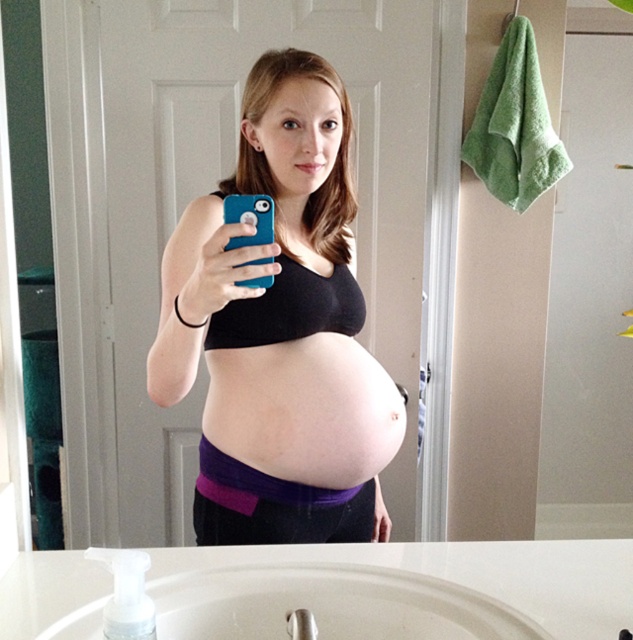
Question: Can you confirm if matte black tank top at center is bigger than pink fabric at center?

Choices:
 (A) yes
 (B) no

Answer: (A)

Question: In this image, where is matte black tank top at center located relative to white ceramic sink at lower center?

Choices:
 (A) below
 (B) above

Answer: (B)

Question: Which point is closer to the camera taking this photo?

Choices:
 (A) (261, 589)
 (B) (379, 388)

Answer: (A)

Question: Which object appears farthest from the camera in this image?

Choices:
 (A) pink fabric at center
 (B) matte black tank top at center
 (C) white ceramic sink at lower center

Answer: (A)

Question: Among these objects, which one is farthest from the camera?

Choices:
 (A) matte black tank top at center
 (B) pink fabric at center
 (C) white ceramic sink at lower center

Answer: (B)

Question: Does matte black tank top at center appear on the right side of pink fabric at center?

Choices:
 (A) no
 (B) yes

Answer: (A)